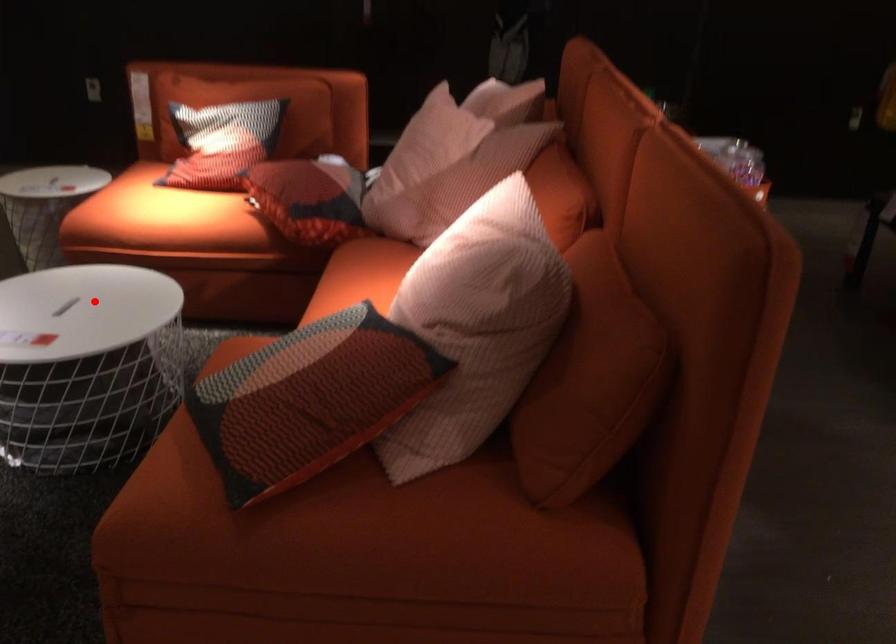
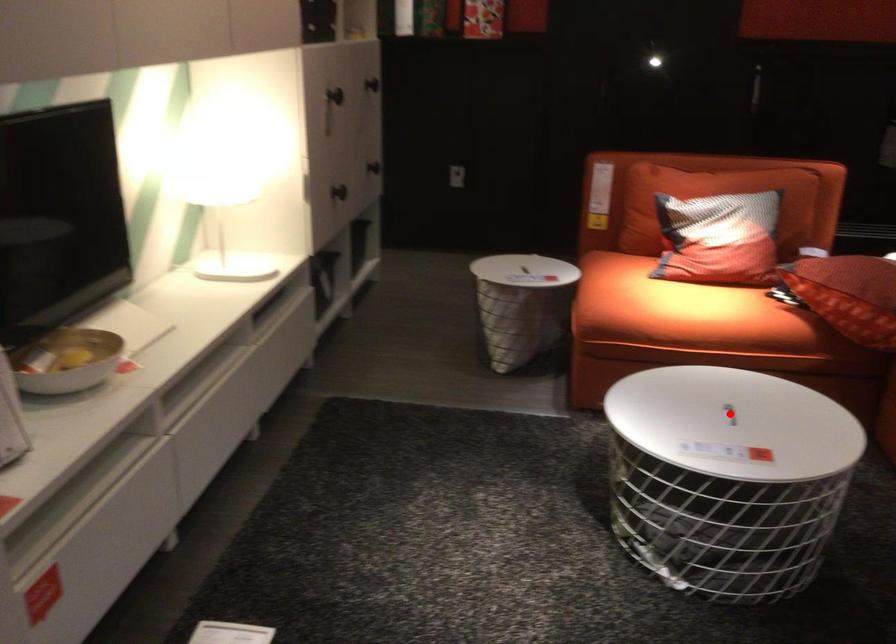
I am providing you with two images of the same scene from different viewpoints. A red point is marked on the first image and another point is marked on the second image. Is the red point in image1 aligned with the point shown in image2?

Yes